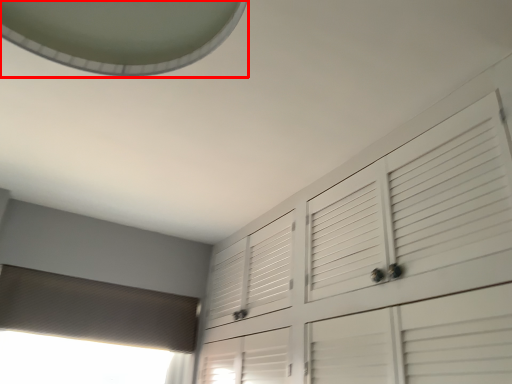
Question: Where is exhaust hood (annotated by the red box) located in relation to blind in the image?

Choices:
 (A) left
 (B) right

Answer: (B)